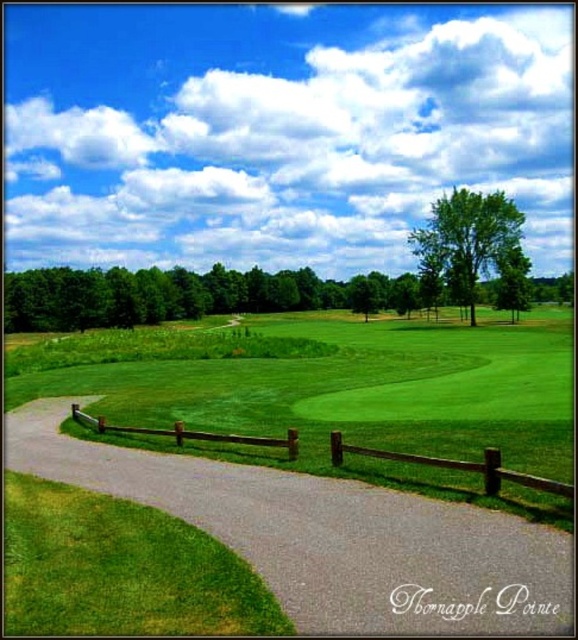
Question: Is gray asphalt path at center smaller than brown wooden fence at center?

Choices:
 (A) no
 (B) yes

Answer: (A)

Question: Which point is farther to the camera?

Choices:
 (A) (497, 262)
 (B) (253, 445)
 (C) (376, 545)

Answer: (A)

Question: Estimate the real-world distances between objects in this image. Which object is closer to the green leafy tree at center?

Choices:
 (A) gray asphalt path at center
 (B) brown wooden fence at center

Answer: (B)

Question: Is gray asphalt path at center thinner than brown wooden fence at center?

Choices:
 (A) yes
 (B) no

Answer: (B)

Question: Estimate the real-world distances between objects in this image. Which object is closer to the gray asphalt path at center?

Choices:
 (A) brown wooden fence at center
 (B) green leafy tree at center

Answer: (A)

Question: Does gray asphalt path at center have a lesser width compared to brown wooden fence at center?

Choices:
 (A) no
 (B) yes

Answer: (A)